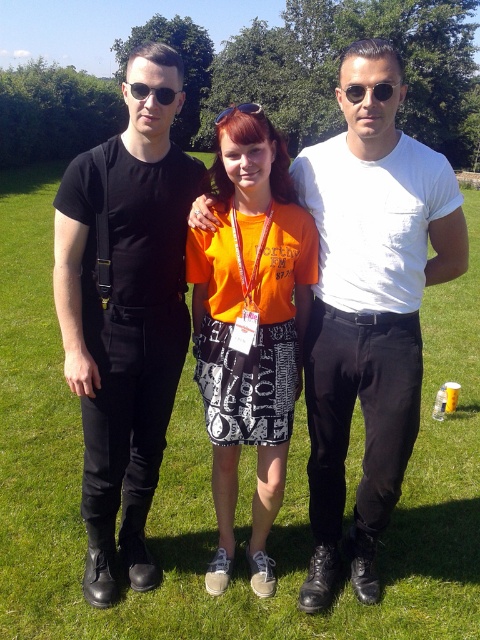
Which is behind, point (143, 403) or point (262, 506)?

Point (262, 506)

In the scene shown: Is black matte/black pants at left closer to camera compared to orange cotton t-shirt at center?

That is False.

Which is in front, point (64, 316) or point (190, 256)?

Point (64, 316) is in front.

Where is `black matte/black pants at left`? black matte/black pants at left is located at coordinates (124, 314).

Does black plastic sunglasses at center have a lesser width compared to blue reflective sunglasses at center?

Yes.

Is black plastic sunglasses at center to the right of blue reflective sunglasses at center from the viewer's perspective?

Yes, black plastic sunglasses at center is to the right of blue reflective sunglasses at center.

Is point (156, 92) farther from camera compared to point (220, 115)?

No, (156, 92) is in front of (220, 115).

At what (x,y) coordinates should I click in order to perform the action: click on black plastic sunglasses at center. Please return your answer as a coordinate pair (x, y). The width and height of the screenshot is (480, 640). Looking at the image, I should click on (152, 92).

Measure the distance from black matte/black pants at left to black plastic sunglasses at center.

31.69 inches

Between point (156, 116) and point (132, 96), which one is positioned in front?

Point (156, 116) is more forward.

Who is more forward, (85,576) or (139,90)?

Point (139,90)

The width and height of the screenshot is (480, 640). In order to click on black matte/black pants at left in this screenshot , I will do `click(124, 314)`.